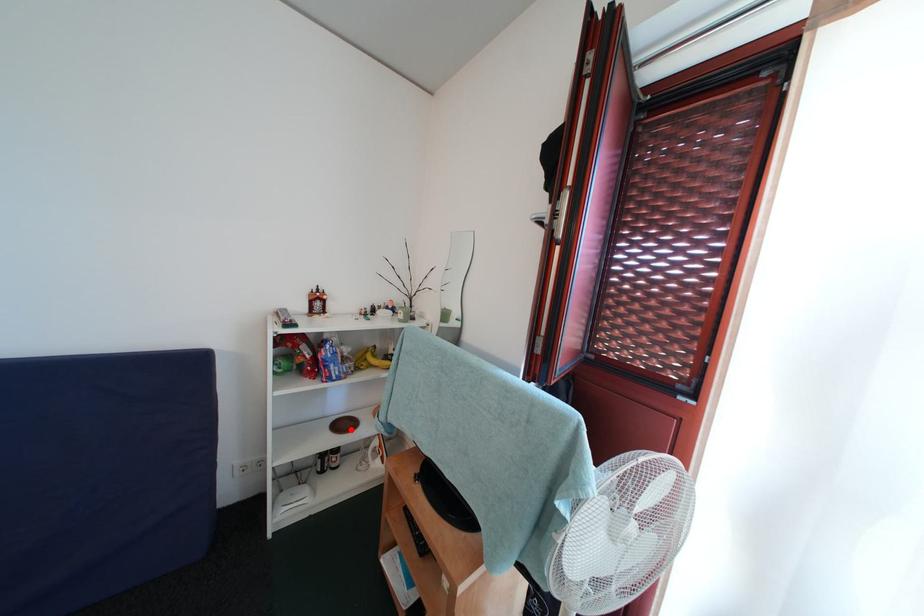
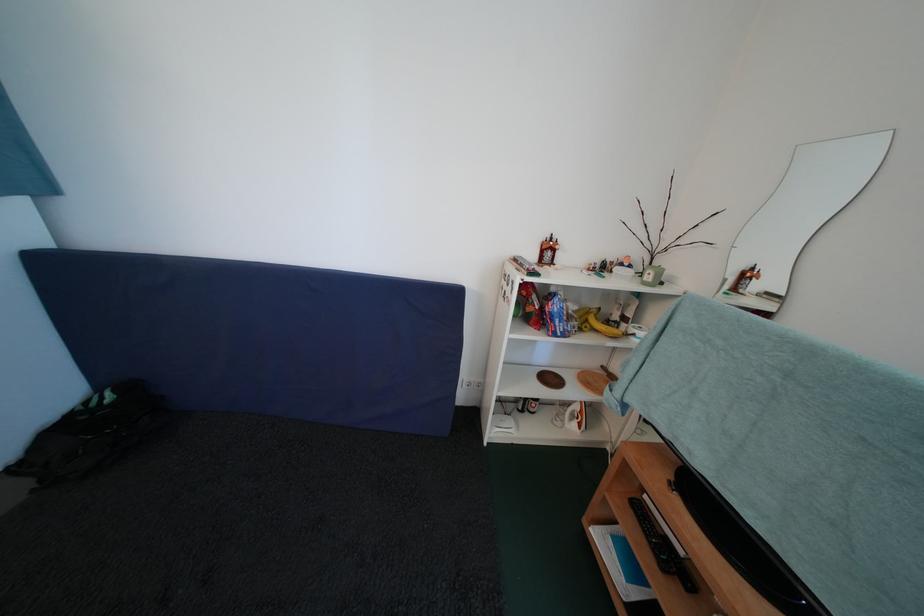
Question: I am providing you with two images of the same scene from different viewpoints. In image1, a red point is highlighted. Considering the same 3D point in image2, which of the following is correct?

Choices:
 (A) It is closer
 (B) It is farther

Answer: (A)